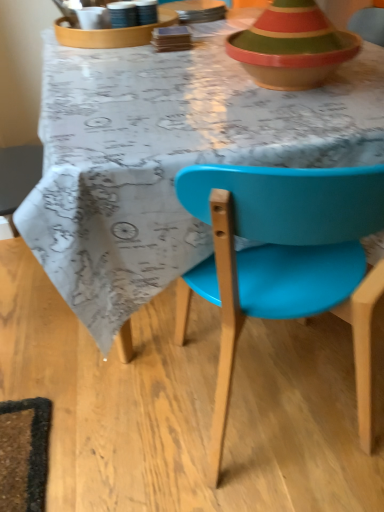
Locate an element on the screen. This screenshot has height=512, width=384. matte plastic chair at center is located at coordinates (168, 158).

Locate an element on the screen. matte ceramic cup at upper center, the second tableware from the left is located at coordinates (123, 14).

How far apart are matte ceramic cup at upper center, the second tableware from the left, and matte white tray at upper center, positioned as the second tableware in right-to-left order?

A distance of 9.02 centimeters exists between matte ceramic cup at upper center, the second tableware from the left, and matte white tray at upper center, positioned as the second tableware in right-to-left order.

From their relative heights in the image, would you say matte ceramic cup at upper center, the second tableware from the left, is taller or shorter than matte white tray at upper center, the first tableware from the left?

Clearly, matte ceramic cup at upper center, the second tableware from the left, is taller compared to matte white tray at upper center, the first tableware from the left.

From a real-world perspective, between matte ceramic cup at upper center, the second tableware from the left, and matte white tray at upper center, the first tableware from the left, who is vertically lower?

In real-world perspective, matte white tray at upper center, the first tableware from the left, is lower.

From the image's perspective, does matte ceramic cup at upper center, the second tableware from the left, appear higher than matte white tray at upper center, positioned as the second tableware in right-to-left order?

No, from the image's perspective, matte ceramic cup at upper center, the second tableware from the left, is not over matte white tray at upper center, positioned as the second tableware in right-to-left order.

Does matte plastic chair at center appear on the left side of matte ceramic cup at upper center, the second tableware from the left?

In fact, matte plastic chair at center is to the right of matte ceramic cup at upper center, the second tableware from the left.

From the image's perspective, would you say matte plastic chair at center is positioned over matte ceramic cup at upper center, the 1th tableware positioned from the right?

Incorrect, from the image's perspective, matte plastic chair at center is lower than matte ceramic cup at upper center, the 1th tableware positioned from the right.

Is matte plastic chair at center completely or partially outside of matte ceramic cup at upper center, the 1th tableware positioned from the right?

Yes, matte plastic chair at center is outside of matte ceramic cup at upper center, the 1th tableware positioned from the right.

Which is behind, point (120, 275) or point (117, 16)?

The point (117, 16) is more distant.

From the image's perspective, is matte ceramic cup at upper center, the second tableware from the left, below matte plastic chair at center?

Actually, matte ceramic cup at upper center, the second tableware from the left, appears above matte plastic chair at center in the image.

From a real-world perspective, is matte ceramic cup at upper center, the second tableware from the left, below matte plastic chair at center?

No, from a real-world perspective, matte ceramic cup at upper center, the second tableware from the left, is not below matte plastic chair at center.

Is matte ceramic cup at upper center, the 1th tableware positioned from the right, looking in the opposite direction of matte plastic chair at center?

matte ceramic cup at upper center, the 1th tableware positioned from the right, does not have its back to matte plastic chair at center.

Locate an element on the screen. The width and height of the screenshot is (384, 512). tableware that is the 1st one when counting upward from the matte plastic chair at center (from the image's perspective) is located at coordinates (123, 14).

Is matte plastic chair at center oriented towards matte plastic chair at center?

No, matte plastic chair at center does not turn towards matte plastic chair at center.

From a real-world perspective, is matte plastic chair at center positioned over matte plastic chair at center based on gravity?

Incorrect, from a real-world perspective, matte plastic chair at center is lower than matte plastic chair at center.

Is point (114, 330) less distant than point (242, 225)?

No, (114, 330) is behind (242, 225).

Is matte plastic chair at center inside or outside of matte plastic chair at center?

matte plastic chair at center is spatially situated outside matte plastic chair at center.

How distant is matte white tray at upper center, positioned as the second tableware in right-to-left order, from matte ceramic cup at upper center, the second tableware from the left?

3.55 inches.

Choose the correct answer: Is matte white tray at upper center, positioned as the second tableware in right-to-left order, inside matte ceramic cup at upper center, the 1th tableware positioned from the right, or outside it?

matte white tray at upper center, positioned as the second tableware in right-to-left order, lies outside matte ceramic cup at upper center, the 1th tableware positioned from the right.

From a real-world perspective, who is located higher, matte white tray at upper center, positioned as the second tableware in right-to-left order, or matte ceramic cup at upper center, the second tableware from the left?

In real-world perspective, matte ceramic cup at upper center, the second tableware from the left, is above.

The width and height of the screenshot is (384, 512). I want to click on desk located on the right of matte white tray at upper center, positioned as the second tableware in right-to-left order, so [x=168, y=158].

Which is less distant, (134,41) or (74,301)?

The point (74,301) is closer to the camera.

From the image's perspective, who appears lower, matte white tray at upper center, positioned as the second tableware in right-to-left order, or matte plastic chair at center?

matte plastic chair at center appears lower in the image.

Considering the relative sizes of matte white tray at upper center, positioned as the second tableware in right-to-left order, and matte plastic chair at center in the image provided, is matte white tray at upper center, positioned as the second tableware in right-to-left order, smaller than matte plastic chair at center?

Correct, matte white tray at upper center, positioned as the second tableware in right-to-left order, occupies less space than matte plastic chair at center.

How different are the orientations of matte ceramic cup at upper center, the second tableware from the left, and matte plastic chair at center in degrees?

There is a 3.38-degree angle between the facing directions of matte ceramic cup at upper center, the second tableware from the left, and matte plastic chair at center.

Is matte ceramic cup at upper center, the second tableware from the left, at the right side of matte plastic chair at center?

Incorrect, matte ceramic cup at upper center, the second tableware from the left, is not on the right side of matte plastic chair at center.

Is matte ceramic cup at upper center, the 1th tableware positioned from the right, in contact with matte plastic chair at center?

No.

Consider the image. From the image's perspective, which object appears higher, matte ceramic cup at upper center, the second tableware from the left, or matte plastic chair at center?

matte ceramic cup at upper center, the second tableware from the left, appears higher in the image.

Find the location of `tableware below the matte ceramic cup at upper center, the second tableware from the left (from a real-world perspective)`. tableware below the matte ceramic cup at upper center, the second tableware from the left (from a real-world perspective) is located at coordinates pos(111,33).

I want to click on the 1st tableware counting from the left side of the matte plastic chair at center, so click(123, 14).

Considering their positions, is matte plastic chair at center positioned closer to matte plastic chair at center than matte ceramic cup at upper center, the 1th tableware positioned from the right?

matte plastic chair at center lies closer to matte plastic chair at center than the other object.

Looking at the image, which one is located closer to matte white tray at upper center, the first tableware from the left, matte plastic chair at center or matte plastic chair at center?

The object closer to matte white tray at upper center, the first tableware from the left, is matte plastic chair at center.

Based on their spatial positions, is matte plastic chair at center or matte white tray at upper center, the first tableware from the left, further from matte ceramic cup at upper center, the second tableware from the left?

matte plastic chair at center is further to matte ceramic cup at upper center, the second tableware from the left.

Based on their spatial positions, is matte white tray at upper center, positioned as the second tableware in right-to-left order, or matte ceramic cup at upper center, the second tableware from the left, further from matte plastic chair at center?

The object further to matte plastic chair at center is matte ceramic cup at upper center, the second tableware from the left.

Looking at the image, which one is located further to matte plastic chair at center, matte ceramic cup at upper center, the 1th tableware positioned from the right, or matte plastic chair at center?

matte ceramic cup at upper center, the 1th tableware positioned from the right, is further to matte plastic chair at center.

Based on the photo, from the image, which object appears to be farther from matte plastic chair at center, matte plastic chair at center or matte white tray at upper center, the first tableware from the left?

Based on the image, matte white tray at upper center, the first tableware from the left, appears to be further to matte plastic chair at center.

When comparing their distances from matte ceramic cup at upper center, the second tableware from the left, does matte white tray at upper center, positioned as the second tableware in right-to-left order, or matte plastic chair at center seem further?

matte plastic chair at center.

When comparing their distances from matte plastic chair at center, does matte ceramic cup at upper center, the 1th tableware positioned from the right, or matte plastic chair at center seem further?

matte ceramic cup at upper center, the 1th tableware positioned from the right, lies further to matte plastic chair at center than the other object.

You are a GUI agent. You are given a task and a screenshot of the screen. Output one action in this format:
    pyautogui.click(x=<x>, y=<y>)
    Task: Click on the desk between matte plastic chair at center and matte ceramic cup at upper center, the second tableware from the left, in the front-back direction
    
    Given the screenshot: What is the action you would take?
    pyautogui.click(x=168, y=158)

You are a GUI agent. You are given a task and a screenshot of the screen. Output one action in this format:
    pyautogui.click(x=<x>, y=<y>)
    Task: Click on the tableware that lies between matte white tray at upper center, positioned as the second tableware in right-to-left order, and matte plastic chair at center from top to bottom
    The height and width of the screenshot is (512, 384).
    Given the screenshot: What is the action you would take?
    pyautogui.click(x=123, y=14)

Locate an element on the screen. tableware between matte plastic chair at center and matte white tray at upper center, the first tableware from the left, in the front-back direction is located at coordinates (123, 14).

This screenshot has height=512, width=384. I want to click on desk that lies between matte white tray at upper center, positioned as the second tableware in right-to-left order, and matte plastic chair at center from top to bottom, so click(x=168, y=158).